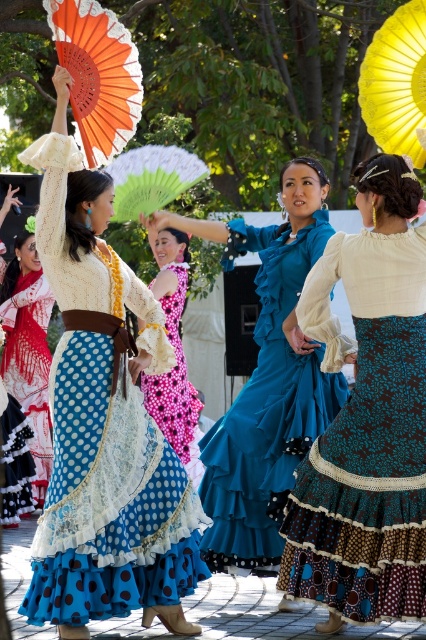
What do you see at coordinates (103, 420) in the screenshot? The width and height of the screenshot is (426, 640). I see `matte white lace dress at center` at bounding box center [103, 420].

Does matte white lace dress at center come behind teal satin dress at center?

That is True.

Between point (63, 634) and point (342, 468), which one is positioned in front?

Point (63, 634) is in front.

Identify the location of matte white lace dress at center. (103, 420).

Does matte blue dress at center appear under yellow fabric umbrella at upper right?

Correct, matte blue dress at center is located below yellow fabric umbrella at upper right.

Can you confirm if matte blue dress at center is wider than yellow fabric umbrella at upper right?

Yes.

The width and height of the screenshot is (426, 640). Describe the element at coordinates (267, 378) in the screenshot. I see `matte blue dress at center` at that location.

This screenshot has height=640, width=426. I want to click on matte blue dress at center, so click(267, 378).

Can you confirm if matte white lace dress at center is positioned above yellow fabric umbrella at upper right?

Incorrect, matte white lace dress at center is not positioned above yellow fabric umbrella at upper right.

Does matte white lace dress at center have a greater width compared to yellow fabric umbrella at upper right?

Yes, matte white lace dress at center is wider than yellow fabric umbrella at upper right.

Is point (100, 406) less distant than point (420, 118)?

Yes, it is in front of point (420, 118).

Locate an element on the screen. The height and width of the screenshot is (640, 426). matte white lace dress at center is located at coordinates (103, 420).